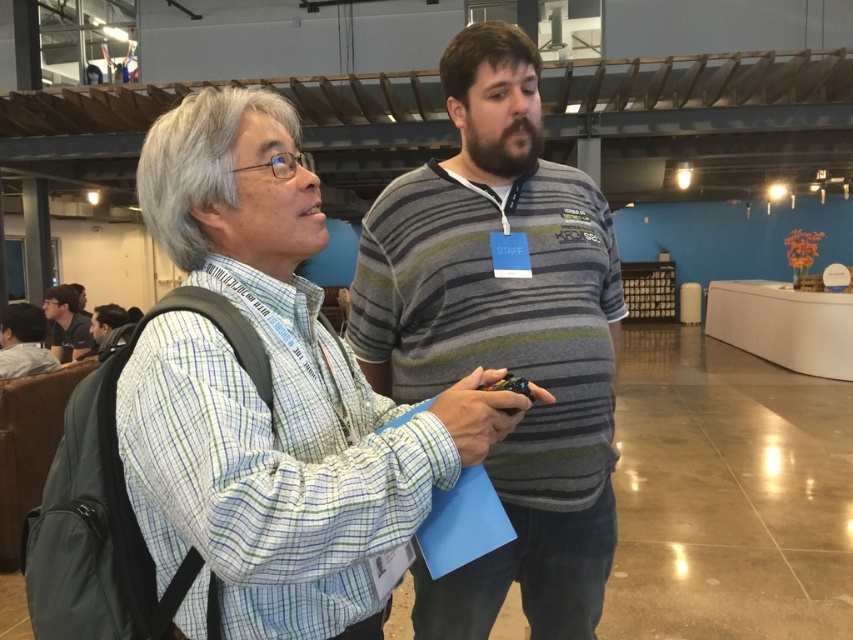
Between point (258, 465) and point (38, 358), which one is positioned behind?

Point (38, 358)

Does plaid shirt at center have a lesser width compared to matte black backpack at left?

Yes.

What do you see at coordinates (273, 394) in the screenshot? I see `plaid shirt at center` at bounding box center [273, 394].

You are a GUI agent. You are given a task and a screenshot of the screen. Output one action in this format:
    pyautogui.click(x=<x>, y=<y>)
    Task: Click on the plaid shirt at center
    The height and width of the screenshot is (640, 853).
    Given the screenshot: What is the action you would take?
    pyautogui.click(x=273, y=394)

Does plaid shirt at center have a lesser height compared to dark gray shirt at lower left?

No.

Does point (161, 358) come farther from viewer compared to point (88, 316)?

No, it is not.

Between point (372, 592) and point (54, 339), which one is positioned in front?

Point (372, 592) is in front.

The image size is (853, 640). I want to click on plaid shirt at center, so click(x=273, y=394).

Locate an element on the screen. This screenshot has width=853, height=640. striped cotton shirt at center is located at coordinates (503, 333).

Which is more to the left, striped cotton shirt at center or dark gray shirt at lower left?

Positioned to the left is dark gray shirt at lower left.

Between point (488, 211) and point (73, 349), which one is positioned behind?

The point (73, 349) is behind.

Find the location of a particular element. striped cotton shirt at center is located at coordinates (503, 333).